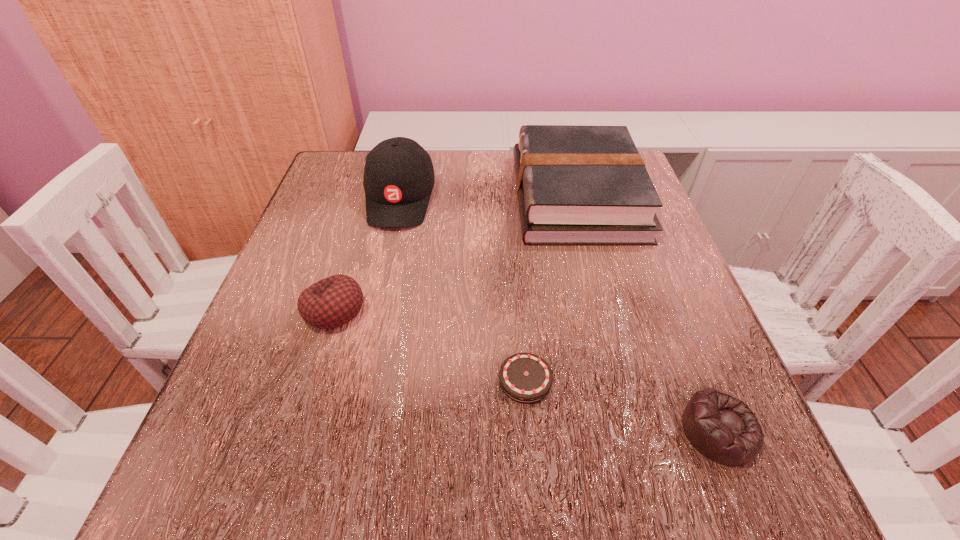
Find the location of a particular element. The width and height of the screenshot is (960, 540). vacant space that satisfies the following two spatial constraints: 1. on the spine side of the nearer beanbag; 2. on the left side of the hardback book is located at coordinates (639, 430).

This screenshot has height=540, width=960. Identify the location of free point that satisfies the following two spatial constraints: 1. on the spine side of the nearer beanbag; 2. on the right side of the fourth shortest object. (639, 430).

Identify the location of vacant space that satisfies the following two spatial constraints: 1. on the front side of the shortest object; 2. on the left side of the nearer beanbag. This screenshot has height=540, width=960. (530, 430).

At what (x,y) coordinates should I click in order to perform the action: click on vacant space that satisfies the following two spatial constraints: 1. on the spine side of the hardback book; 2. with a logo on the front of the tallest object. Please return your answer as a coordinate pair (x, y). Looking at the image, I should click on point(577,199).

This screenshot has width=960, height=540. What are the coordinates of `vacant space that satisfies the following two spatial constraints: 1. on the spine side of the second shortest object; 2. on the right side of the fourth shortest object` in the screenshot? It's located at (639, 430).

Image resolution: width=960 pixels, height=540 pixels. In order to click on vacant space that satisfies the following two spatial constraints: 1. on the spine side of the fourth shortest object; 2. with a logo on the front of the tallest object in this screenshot , I will do `click(577, 199)`.